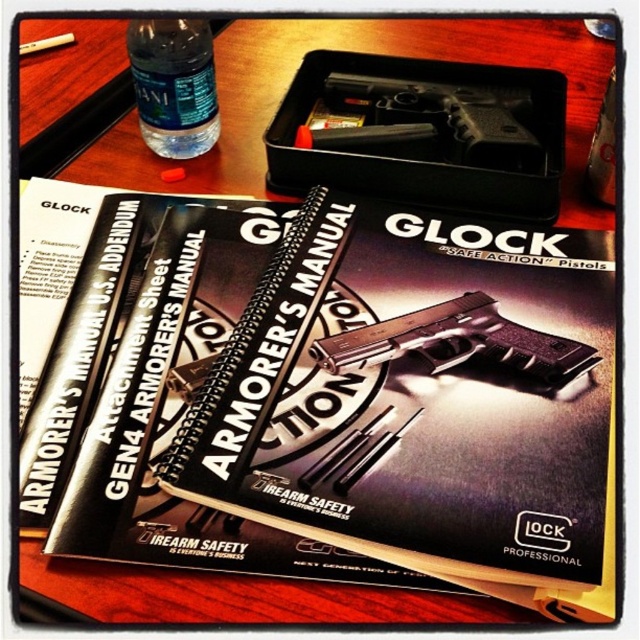
Is matte black manual at center taller than black plastic handgun at center?

Yes.

Does point (464, 291) lie behind point (369, 97)?

No, (464, 291) is closer to viewer.

Where is `matte black manual at center`? Image resolution: width=640 pixels, height=640 pixels. matte black manual at center is located at coordinates (381, 410).

Does point (508, 312) lie behind point (518, 333)?

Yes, point (508, 312) is behind point (518, 333).

Can you confirm if matte black manual at center is shorter than matte black handgun at center?

In fact, matte black manual at center may be taller than matte black handgun at center.

Is point (454, 392) positioned behind point (340, 339)?

No, (454, 392) is closer to viewer.

You are a GUI agent. You are given a task and a screenshot of the screen. Output one action in this format:
    pyautogui.click(x=<x>, y=<y>)
    Task: Click on the matte black manual at center
    
    Given the screenshot: What is the action you would take?
    pyautogui.click(x=381, y=410)

Who is positioned more to the left, matte black handgun at center or clear plastic bottle at upper left?

Positioned to the left is clear plastic bottle at upper left.

Between point (547, 340) and point (189, 58), which one is positioned in front?

Point (547, 340) is more forward.

Where is `matte black handgun at center`? This screenshot has width=640, height=640. matte black handgun at center is located at coordinates (458, 342).